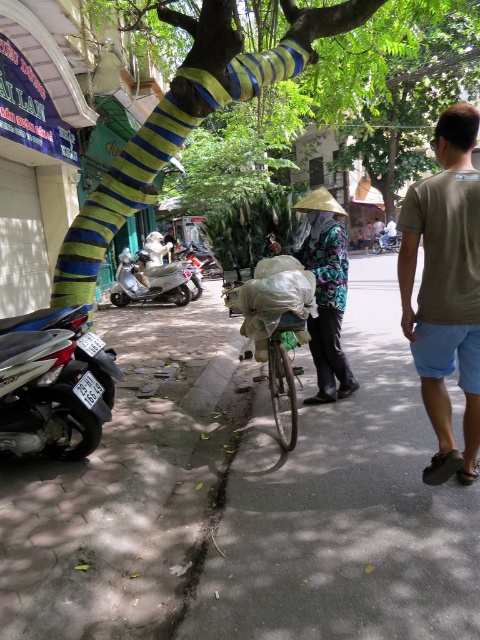
You are standing at the point marked as point (243, 499) in the image. What is the closest object to you in the scene?

The paved concrete sidewalk at lower left is located at point (243, 499), so the closest object to you is the paved concrete sidewalk at lower left.